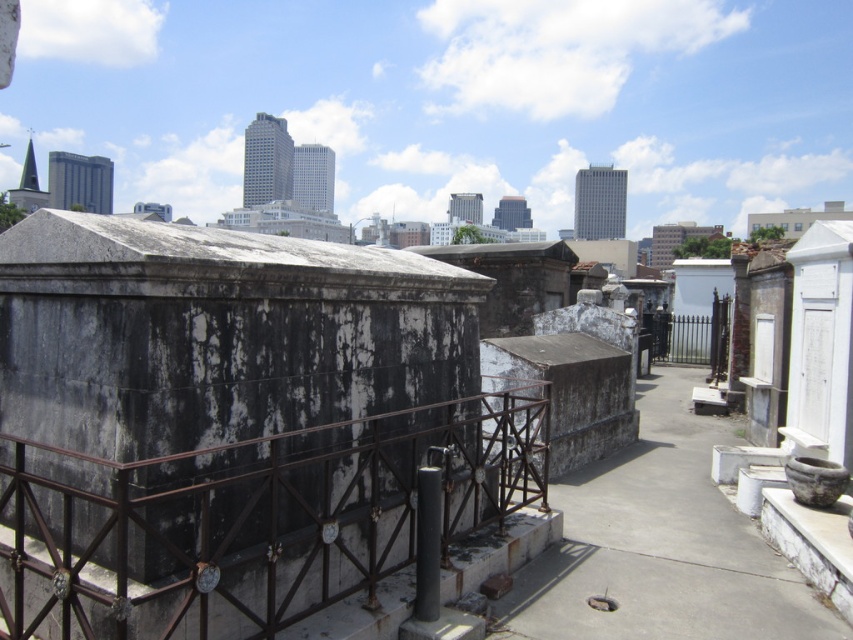
You are standing at the entrance of the cemetery and want to reach the rusty metal railing at center. Based on the coordinates provided in the Objects Description, in which direction should you move relative to your current position?

The rusty metal railing at center is located at coordinates point (253, 518). Since coordinates typically increase from the bottom left corner, moving towards higher x values means moving right, and higher y values mean moving up. To reach the railing, you should move to the right and slightly upwards from your current position at the entrance.

You are a gardener trying to place a new 1.5 meter wide flower bed between the rusty metal railing at center and the gray concrete pavement at center. Can the flower bed fit in the space between them?

The rusty metal railing at center is narrower than the gray concrete pavement at center, but the description only states their widths relative to each other without specifying exact measurements. Since the flower bed is 1.5 meters wide, we cannot determine if the space between them is sufficient without knowing the actual width of the pathway. Please measure the space before placing the flower bed.

You are a maintenance worker tasked with assessing the condition of the rusty metal railing at center and the gray concrete pavement at center in the cemetery. Which object requires immediate attention based on their sizes?

The rusty metal railing at center is larger in size than the gray concrete pavement at center, so it requires immediate attention.